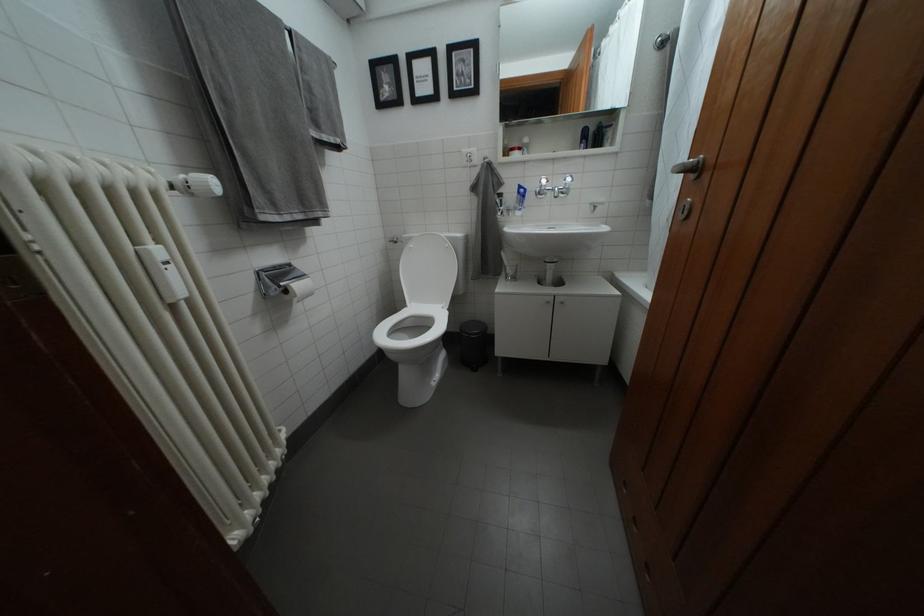
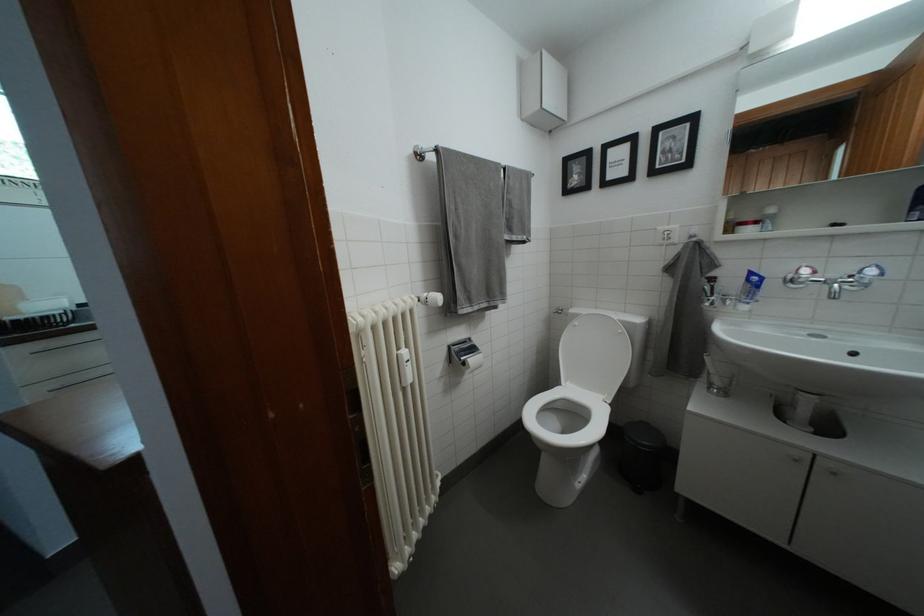
Locate, in the second image, the point that corresponds to the point at 296,297 in the first image.

(472, 369)